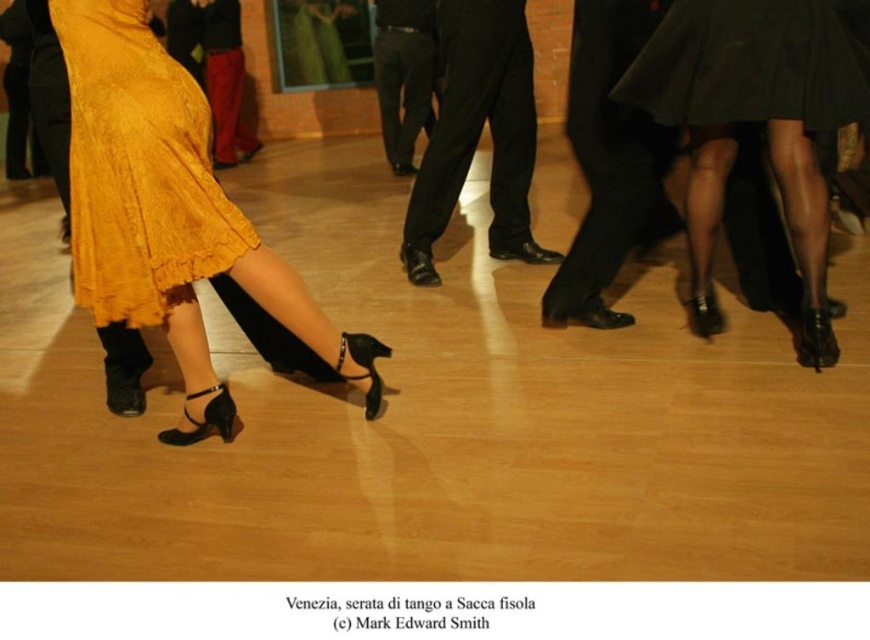
Question: Is shiny black skirt at upper right positioned before black smooth pants at center?

Choices:
 (A) yes
 (B) no

Answer: (A)

Question: Where is black leather pants at center located in relation to black smooth pants at center in the image?

Choices:
 (A) above
 (B) below

Answer: (B)

Question: Which point is farther from the camera taking this photo?

Choices:
 (A) (832, 106)
 (B) (87, 33)

Answer: (A)

Question: Which point is farther to the camera?

Choices:
 (A) shiny black skirt at upper right
 (B) black smooth pants at center
 (C) black satin skirt at upper center

Answer: (B)

Question: Based on their relative distances, which object is nearer to the shiny black skirt at upper right?

Choices:
 (A) black smooth pants at center
 (B) mustard yellow fabric skirt at lower left
 (C) black leather pants at center
 (D) matte yellow dress at left

Answer: (C)

Question: Can you confirm if matte yellow dress at left is thinner than mustard yellow fabric skirt at lower left?

Choices:
 (A) yes
 (B) no

Answer: (B)